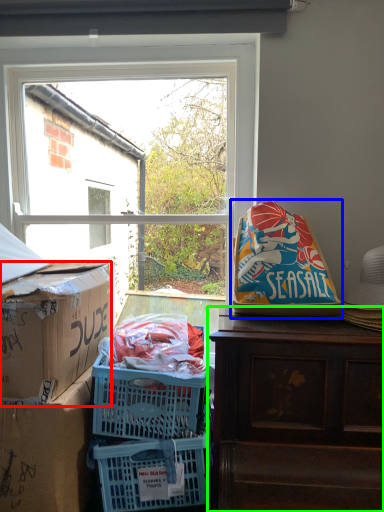
Question: Based on their relative distances, which object is nearer to box (highlighted by a red box)? Choose from bean bag chair (highlighted by a blue box) and desk (highlighted by a green box).

Choices:
 (A) bean bag chair
 (B) desk

Answer: (B)